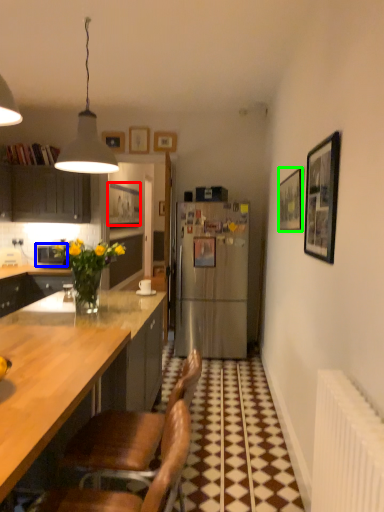
Question: Which is nearer to the picture frame (highlighted by a red box)? appliance (highlighted by a blue box) or picture frame (highlighted by a green box).

Choices:
 (A) appliance
 (B) picture frame

Answer: (A)